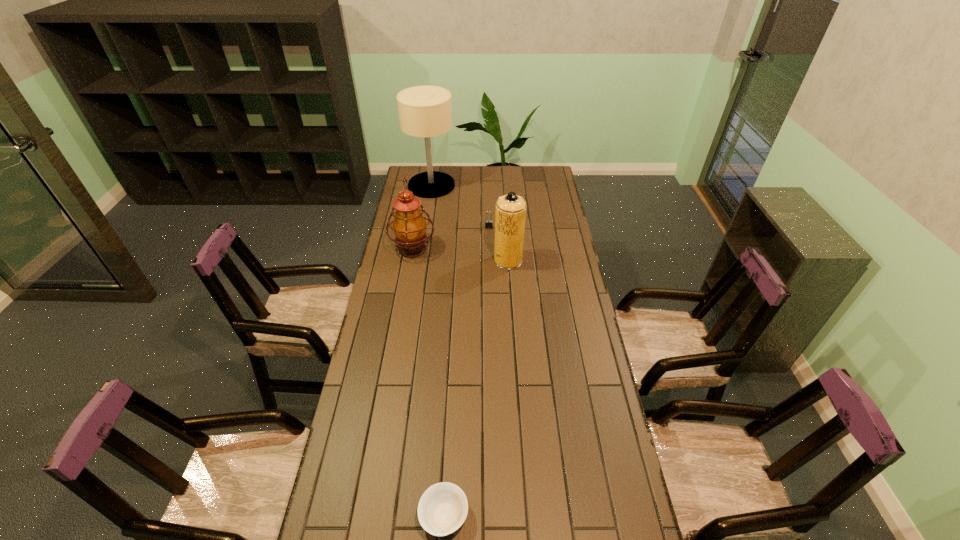
You are a GUI agent. You are given a task and a screenshot of the screen. Output one action in this format:
    pyautogui.click(x=<x>, y=<y>)
    Task: Click on the object that is at the far edge
    This screenshot has height=540, width=960.
    Given the screenshot: What is the action you would take?
    pyautogui.click(x=425, y=111)

Where is `table lamp at the left edge`? This screenshot has height=540, width=960. table lamp at the left edge is located at coordinates (425, 111).

Image resolution: width=960 pixels, height=540 pixels. I want to click on oil lamp that is positioned at the left edge, so click(x=409, y=226).

Find the location of `object that is at the far left corner`. object that is at the far left corner is located at coordinates (425, 111).

In the image, there is a desktop. Identify the location of vacant area at the far edge. Image resolution: width=960 pixels, height=540 pixels. (460, 179).

This screenshot has height=540, width=960. I want to click on vacant space at the left edge, so click(430, 206).

Image resolution: width=960 pixels, height=540 pixels. Identify the location of free region at the right edge of the desktop. (556, 310).

Identify the location of free region at the far right corner. (525, 176).

Where is `free space between the farthest object and the fourth tallest object`? The height and width of the screenshot is (540, 960). free space between the farthest object and the fourth tallest object is located at coordinates (460, 206).

Where is `empty location between the oil lamp and the padlock`? The height and width of the screenshot is (540, 960). empty location between the oil lamp and the padlock is located at coordinates (451, 238).